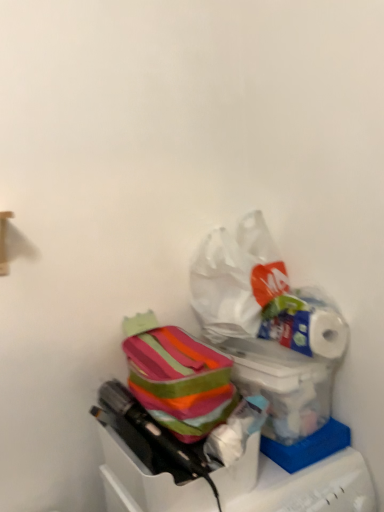
Measure the distance between striped fabric lunchbox at center and camera.

They are 39.13 inches apart.

The image size is (384, 512). What do you see at coordinates (305, 325) in the screenshot? I see `white glossy toilet paper at upper right` at bounding box center [305, 325].

What are the coordinates of `translucent plastic bag at lower right, the 1th box in the top-to-bottom sequence` in the screenshot? It's located at (283, 386).

In order to face translucent plastic bag at lower right, the 2th box when ordered from bottom to top, should I rotate leftwards or rightwards?

Answer: Rotate right and turn 10.101 degrees.

Find the location of a particular element. Image resolution: width=384 pixels, height=512 pixels. striped fabric lunchbox at center is located at coordinates (177, 377).

Considering the relative sizes of translucent plastic bag at lower right, the 1th box in the top-to-bottom sequence, and striped fabric bag at center, which is the 1th box in bottom-to-top order, in the image provided, is translucent plastic bag at lower right, the 1th box in the top-to-bottom sequence, smaller than striped fabric bag at center, which is the 1th box in bottom-to-top order,?

Yes, translucent plastic bag at lower right, the 1th box in the top-to-bottom sequence, is smaller than striped fabric bag at center, which is the 1th box in bottom-to-top order.

Is translucent plastic bag at lower right, the 1th box in the top-to-bottom sequence, in contact with striped fabric bag at center, which is the 1th box in bottom-to-top order?

They are not placed beside each other.

Is translucent plastic bag at lower right, the 1th box in the top-to-bottom sequence, turned away from striped fabric bag at center, which is the 1th box in bottom-to-top order?

No, translucent plastic bag at lower right, the 1th box in the top-to-bottom sequence,'s orientation is not away from striped fabric bag at center, which is the 1th box in bottom-to-top order.

Does translucent plastic bag at lower right, the 1th box in the top-to-bottom sequence, come in front of striped fabric bag at center, which is the 2th box in top-to-bottom order?

No, translucent plastic bag at lower right, the 1th box in the top-to-bottom sequence, is further to the viewer.

Considering the relative sizes of striped fabric lunchbox at center and translucent plastic bag at lower right, the 2th box when ordered from bottom to top, in the image provided, is striped fabric lunchbox at center thinner than translucent plastic bag at lower right, the 2th box when ordered from bottom to top,?

In fact, striped fabric lunchbox at center might be wider than translucent plastic bag at lower right, the 2th box when ordered from bottom to top.

Is striped fabric lunchbox at center completely or partially outside of translucent plastic bag at lower right, the 2th box when ordered from bottom to top?

Yes, striped fabric lunchbox at center is located beyond the bounds of translucent plastic bag at lower right, the 2th box when ordered from bottom to top.

Based on the photo, from the image's perspective, is striped fabric lunchbox at center located beneath translucent plastic bag at lower right, the 1th box in the top-to-bottom sequence?

No, from the image's perspective, striped fabric lunchbox at center is not below translucent plastic bag at lower right, the 1th box in the top-to-bottom sequence.

In terms of height, does white glossy toilet paper at upper right look taller or shorter compared to striped fabric lunchbox at center?

In the image, white glossy toilet paper at upper right appears to be shorter than striped fabric lunchbox at center.

Can we say white glossy toilet paper at upper right lies outside striped fabric lunchbox at center?

That's correct, white glossy toilet paper at upper right is outside of striped fabric lunchbox at center.

Looking at this image, which is in front, white glossy toilet paper at upper right or striped fabric lunchbox at center?

striped fabric lunchbox at center.

Can you confirm if white glossy toilet paper at upper right is smaller than striped fabric lunchbox at center?

Yes, white glossy toilet paper at upper right is smaller than striped fabric lunchbox at center.

Is the surface of white glossy toilet paper at upper right in direct contact with translucent plastic bag at lower right, the 2th box when ordered from bottom to top?

Yes, white glossy toilet paper at upper right is in contact with translucent plastic bag at lower right, the 2th box when ordered from bottom to top.

From the picture: From the image's perspective, is white glossy toilet paper at upper right located above or below translucent plastic bag at lower right, the 1th box in the top-to-bottom sequence?

Clearly, from the image's perspective, white glossy toilet paper at upper right is above translucent plastic bag at lower right, the 1th box in the top-to-bottom sequence.

Considering the positions of objects white glossy toilet paper at upper right and translucent plastic bag at lower right, the 2th box when ordered from bottom to top, in the image provided, who is in front, white glossy toilet paper at upper right or translucent plastic bag at lower right, the 2th box when ordered from bottom to top,?

translucent plastic bag at lower right, the 2th box when ordered from bottom to top, is in front.

In the scene shown: From a real-world perspective, relative to translucent plastic bag at lower right, the 1th box in the top-to-bottom sequence, is white glossy toilet paper at upper right vertically above or below?

In terms of real-world spatial position, white glossy toilet paper at upper right is above translucent plastic bag at lower right, the 1th box in the top-to-bottom sequence.

How much distance is there between white plastic bag at upper center and translucent plastic bag at lower right, the 2th box when ordered from bottom to top?

white plastic bag at upper center is 5.19 inches away from translucent plastic bag at lower right, the 2th box when ordered from bottom to top.

Is white plastic bag at upper center in contact with translucent plastic bag at lower right, the 2th box when ordered from bottom to top?

No, white plastic bag at upper center is not beside translucent plastic bag at lower right, the 2th box when ordered from bottom to top.

Can you confirm if white plastic bag at upper center is bigger than translucent plastic bag at lower right, the 2th box when ordered from bottom to top?

Yes.

Does white plastic bag at upper center have a greater height compared to translucent plastic bag at lower right, the 2th box when ordered from bottom to top?

Yes, white plastic bag at upper center is taller than translucent plastic bag at lower right, the 2th box when ordered from bottom to top.

Is white plastic bag at upper center facing towards striped fabric lunchbox at center?

No, white plastic bag at upper center is not turned towards striped fabric lunchbox at center.

Is point (234, 283) less distant than point (196, 426)?

That is False.

From a real-world perspective, which is physically above, white plastic bag at upper center or striped fabric lunchbox at center?

In real-world perspective, white plastic bag at upper center is above.

Considering the sizes of objects white plastic bag at upper center and striped fabric lunchbox at center in the image provided, who is smaller, white plastic bag at upper center or striped fabric lunchbox at center?

Smaller between the two is striped fabric lunchbox at center.

From the image's perspective, which object appears higher, white plastic bag at upper center or striped fabric bag at center, which is the 1th box in bottom-to-top order?

white plastic bag at upper center, from the image's perspective.

What's the angular difference between white plastic bag at upper center and striped fabric bag at center, which is the 1th box in bottom-to-top order,'s facing directions?

1.7e-05 degrees.

Is white plastic bag at upper center turned away from striped fabric bag at center, which is the 2th box in top-to-bottom order?

white plastic bag at upper center is not turned away from striped fabric bag at center, which is the 2th box in top-to-bottom order.

Does point (240, 298) appear closer or farther from the camera than point (168, 502)?

Point (240, 298) is farther from the camera than point (168, 502).

This screenshot has height=512, width=384. I want to click on box below the translucent plastic bag at lower right, the 1th box in the top-to-bottom sequence (from the image's perspective), so click(x=163, y=459).

Where is `material on the left of translucent plastic bag at lower right, the 1th box in the top-to-bottom sequence`? This screenshot has width=384, height=512. material on the left of translucent plastic bag at lower right, the 1th box in the top-to-bottom sequence is located at coordinates (177, 377).

Considering their positions, is white glossy toilet paper at upper right positioned further to striped fabric bag at center, which is the 1th box in bottom-to-top order, than translucent plastic bag at lower right, the 1th box in the top-to-bottom sequence?

Among the two, white glossy toilet paper at upper right is located further to striped fabric bag at center, which is the 1th box in bottom-to-top order.

When comparing their distances from striped fabric lunchbox at center, does white plastic bag at upper center or translucent plastic bag at lower right, the 1th box in the top-to-bottom sequence, seem further?

The object further to striped fabric lunchbox at center is white plastic bag at upper center.

When comparing their distances from white plastic bag at upper center, does white glossy toilet paper at upper right or translucent plastic bag at lower right, the 1th box in the top-to-bottom sequence, seem further?

translucent plastic bag at lower right, the 1th box in the top-to-bottom sequence, is positioned further to the anchor white plastic bag at upper center.

Based on their spatial positions, is striped fabric lunchbox at center or white plastic bag at upper center closer to striped fabric bag at center, which is the 1th box in bottom-to-top order?

Among the two, striped fabric lunchbox at center is located nearer to striped fabric bag at center, which is the 1th box in bottom-to-top order.

Based on their spatial positions, is white glossy toilet paper at upper right or striped fabric bag at center, which is the 1th box in bottom-to-top order, further from striped fabric lunchbox at center?

The object further to striped fabric lunchbox at center is white glossy toilet paper at upper right.

Which object lies nearer to the anchor point white glossy toilet paper at upper right, striped fabric lunchbox at center or white plastic bag at upper center?

Among the two, white plastic bag at upper center is located nearer to white glossy toilet paper at upper right.

From the picture: Based on their spatial positions, is white plastic bag at upper center or translucent plastic bag at lower right, the 2th box when ordered from bottom to top, closer to striped fabric bag at center, which is the 1th box in bottom-to-top order?

Among the two, translucent plastic bag at lower right, the 2th box when ordered from bottom to top, is located nearer to striped fabric bag at center, which is the 1th box in bottom-to-top order.

Which object lies further to the anchor point white glossy toilet paper at upper right, white plastic bag at upper center or striped fabric bag at center, which is the 1th box in bottom-to-top order?

Among the two, striped fabric bag at center, which is the 1th box in bottom-to-top order, is located further to white glossy toilet paper at upper right.

Where is `box situated between striped fabric bag at center, which is the 1th box in bottom-to-top order, and white glossy toilet paper at upper right from left to right`? The width and height of the screenshot is (384, 512). box situated between striped fabric bag at center, which is the 1th box in bottom-to-top order, and white glossy toilet paper at upper right from left to right is located at coordinates (283, 386).

Locate an element on the screen. The height and width of the screenshot is (512, 384). box between white plastic bag at upper center and striped fabric bag at center, which is the 1th box in bottom-to-top order, vertically is located at coordinates (283, 386).

Identify the location of material that lies between white plastic bag at upper center and translucent plastic bag at lower right, the 1th box in the top-to-bottom sequence, from top to bottom. (177, 377).

This screenshot has height=512, width=384. I want to click on toilet paper between white plastic bag at upper center and striped fabric bag at center, which is the 1th box in bottom-to-top order, in the vertical direction, so click(305, 325).